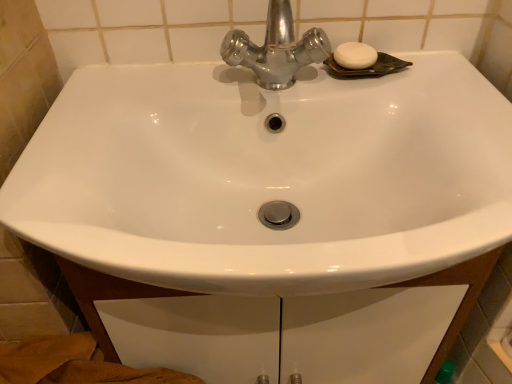
This screenshot has width=512, height=384. What are the coordinates of `free space that is to the left of shiny metallic faucet at upper center` in the screenshot? It's located at (156, 95).